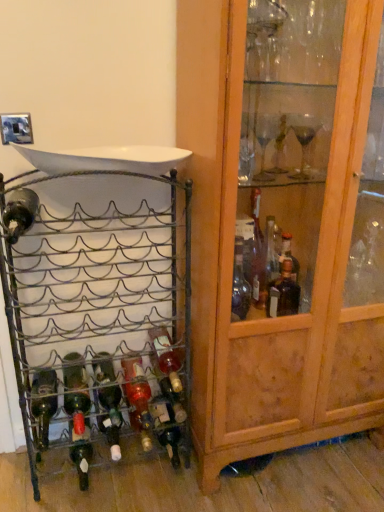
You are a GUI agent. You are given a task and a screenshot of the screen. Output one action in this format:
    pyautogui.click(x=<x>, y=<y>)
    Task: Click on the free space that is in between translucent glass bottle at lower left, positioned as the third bottle in left-to-right order, and metallic wire wine rack at left
    
    Given the screenshot: What is the action you would take?
    pyautogui.click(x=109, y=485)